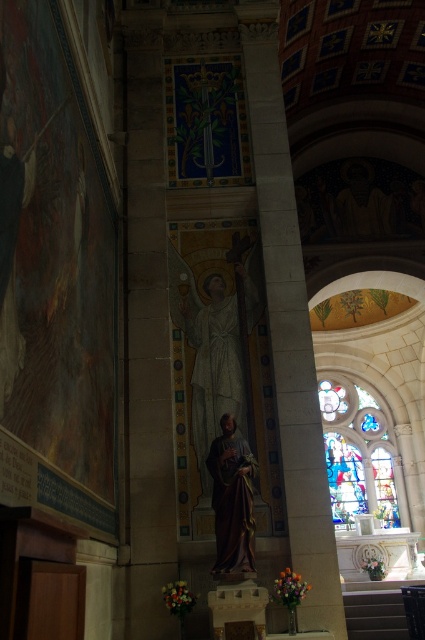
In the scene shown: Can you confirm if matte white statue at center is positioned to the right of stained glass window at center?

Incorrect, matte white statue at center is not on the right side of stained glass window at center.

Which is more to the left, matte white statue at center or stained glass window at center?

matte white statue at center is more to the left.

Between point (197, 365) and point (339, 403), which one is positioned in front?

Point (197, 365)

This screenshot has height=640, width=425. Find the location of `matte white statue at center`. matte white statue at center is located at coordinates (209, 356).

At what (x,y) coordinates should I click in order to perform the action: click on matte white statue at center. Please return your answer as a coordinate pair (x, y). Image resolution: width=425 pixels, height=640 pixels. Looking at the image, I should click on (209, 356).

What do you see at coordinates (209, 356) in the screenshot? I see `matte white statue at center` at bounding box center [209, 356].

At what (x,y) coordinates should I click in order to perform the action: click on matte white statue at center. Please return your answer as a coordinate pair (x, y). The height and width of the screenshot is (640, 425). Looking at the image, I should click on (209, 356).

What are the coordinates of `matte white statue at center` in the screenshot? It's located at (209, 356).

Can you confirm if stained glass window at center is smaller than golden polished statue at center?

Incorrect, stained glass window at center is not smaller in size than golden polished statue at center.

Which is more to the left, stained glass window at center or golden polished statue at center?

From the viewer's perspective, golden polished statue at center appears more on the left side.

At what (x,y) coordinates should I click in order to perform the action: click on stained glass window at center. Please return your answer as a coordinate pair (x, y). Image resolution: width=425 pixels, height=640 pixels. Looking at the image, I should click on (359, 454).